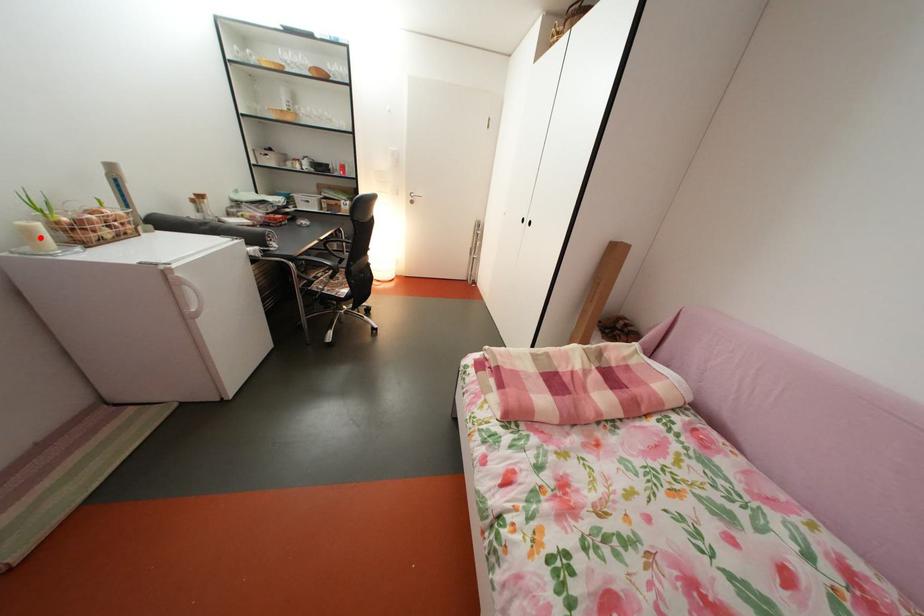
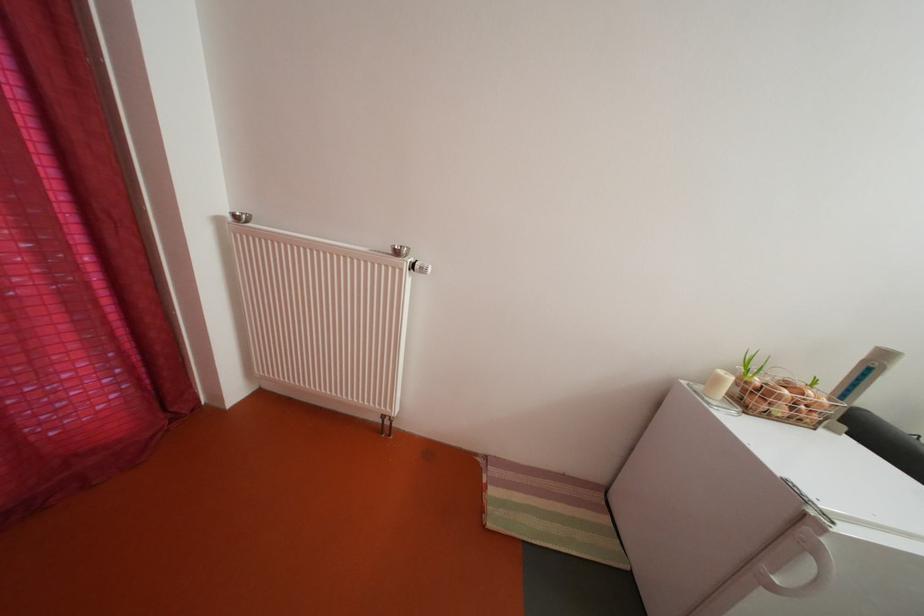
Question: I am providing you with two images of the same scene from different viewpoints. A red point is marked on the first image. At the location where the point appears in image 1, is it still visible in image 2?

Choices:
 (A) Yes
 (B) No

Answer: (A)